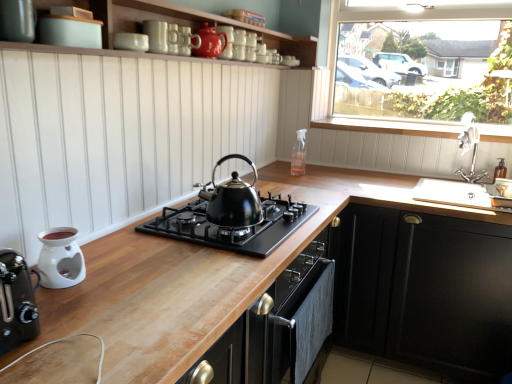
Question: From the image's perspective, is silver metallic faucet at upper right under clear glass spray bottle at upper center, the fourth appliance from the front?

Choices:
 (A) yes
 (B) no

Answer: (A)

Question: Is silver metallic faucet at upper right positioned in front of clear glass spray bottle at upper center, the third appliance when ordered from top to bottom?

Choices:
 (A) no
 (B) yes

Answer: (B)

Question: Does silver metallic faucet at upper right have a lesser height compared to clear glass spray bottle at upper center, which is the 1th appliance from right to left?

Choices:
 (A) yes
 (B) no

Answer: (B)

Question: Considering the relative sizes of silver metallic faucet at upper right and clear glass spray bottle at upper center, the fourth appliance from the front, in the image provided, is silver metallic faucet at upper right taller than clear glass spray bottle at upper center, the fourth appliance from the front,?

Choices:
 (A) no
 (B) yes

Answer: (B)

Question: Does silver metallic faucet at upper right touch clear glass spray bottle at upper center, the 2th appliance ordered from the bottom?

Choices:
 (A) yes
 (B) no

Answer: (B)

Question: From the image's perspective, is transparent glass window at upper right above or below clear glass spray bottle at upper center, the third appliance when ordered from top to bottom?

Choices:
 (A) below
 (B) above

Answer: (B)

Question: Is transparent glass window at upper right inside the boundaries of clear glass spray bottle at upper center, which is the 1th appliance from right to left, or outside?

Choices:
 (A) outside
 (B) inside

Answer: (A)

Question: Considering their positions, is transparent glass window at upper right located in front of or behind clear glass spray bottle at upper center, which is the 1th appliance from right to left?

Choices:
 (A) behind
 (B) front

Answer: (B)

Question: Is transparent glass window at upper right bigger or smaller than clear glass spray bottle at upper center, which is the 1th appliance from right to left?

Choices:
 (A) small
 (B) big

Answer: (B)

Question: Is black matte gas stove at center bigger or smaller than silver metallic faucet at upper right?

Choices:
 (A) small
 (B) big

Answer: (B)

Question: Considering the positions of point (280, 221) and point (467, 132), is point (280, 221) closer or farther from the camera than point (467, 132)?

Choices:
 (A) closer
 (B) farther

Answer: (A)

Question: Would you say black matte gas stove at center is to the left or to the right of silver metallic faucet at upper right in the picture?

Choices:
 (A) left
 (B) right

Answer: (A)

Question: From the image's perspective, is black matte gas stove at center above or below silver metallic faucet at upper right?

Choices:
 (A) below
 (B) above

Answer: (A)

Question: In terms of width, does transparent glass window at upper right look wider or thinner when compared to black matte gas stove at center?

Choices:
 (A) thin
 (B) wide

Answer: (A)

Question: Is transparent glass window at upper right situated inside black matte gas stove at center or outside?

Choices:
 (A) outside
 (B) inside

Answer: (A)